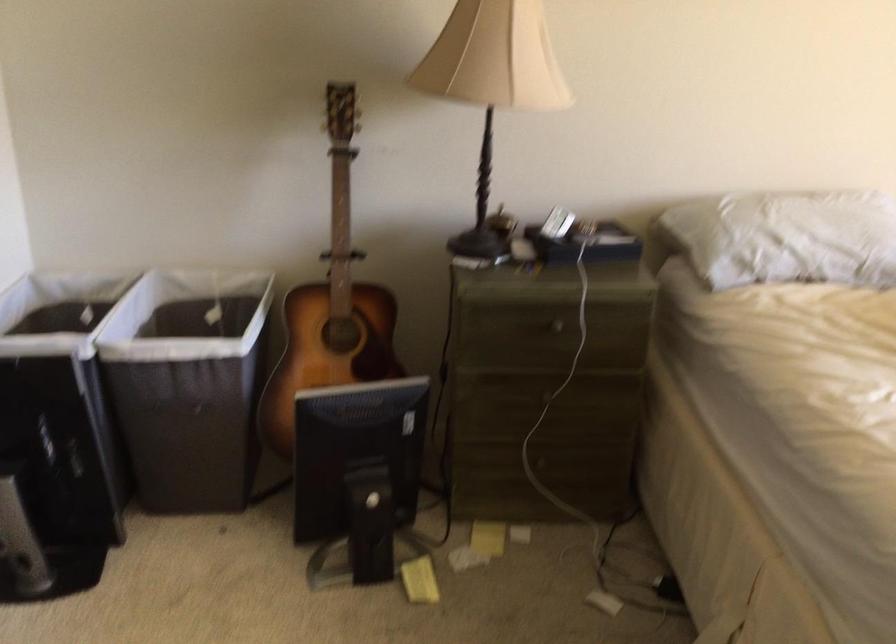
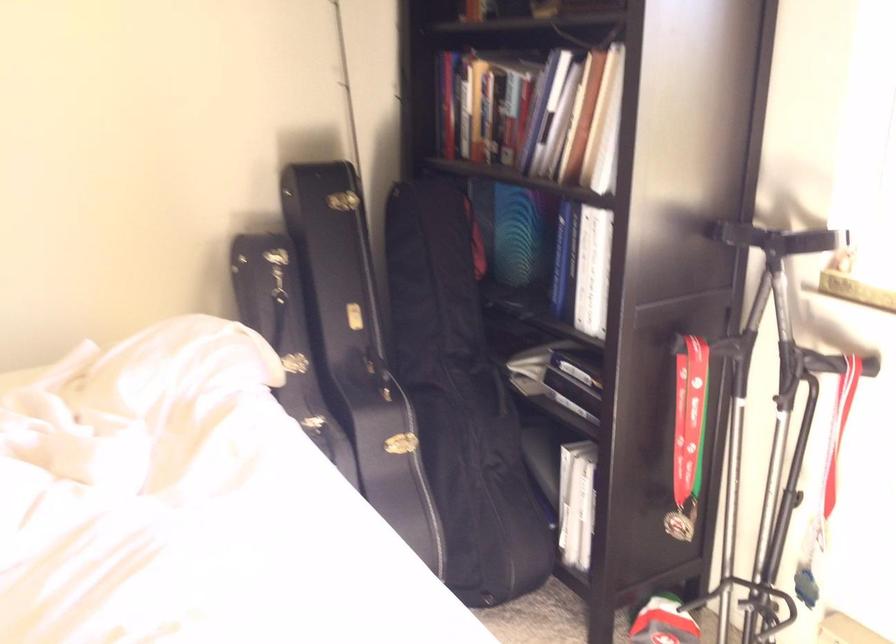
Question: What movement of the cameraman would produce the second image?

Choices:
 (A) Left
 (B) Right
 (C) Forward
 (D) Backward

Answer: (B)